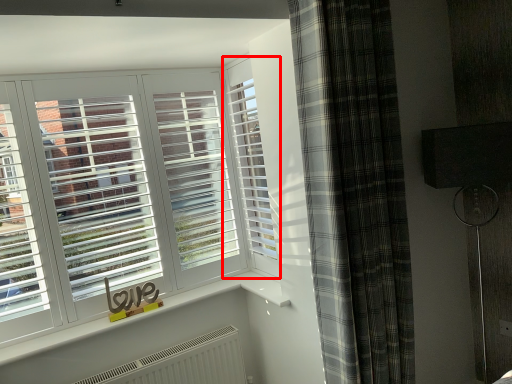
Question: From the image's perspective, what is the correct spatial relationship of window (annotated by the red box) in relation to curtain?

Choices:
 (A) below
 (B) above

Answer: (B)